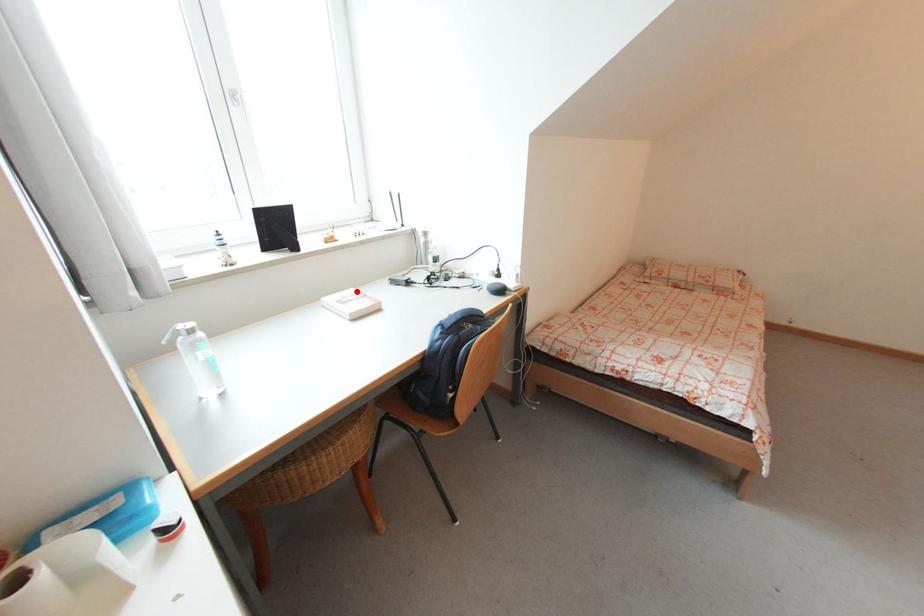
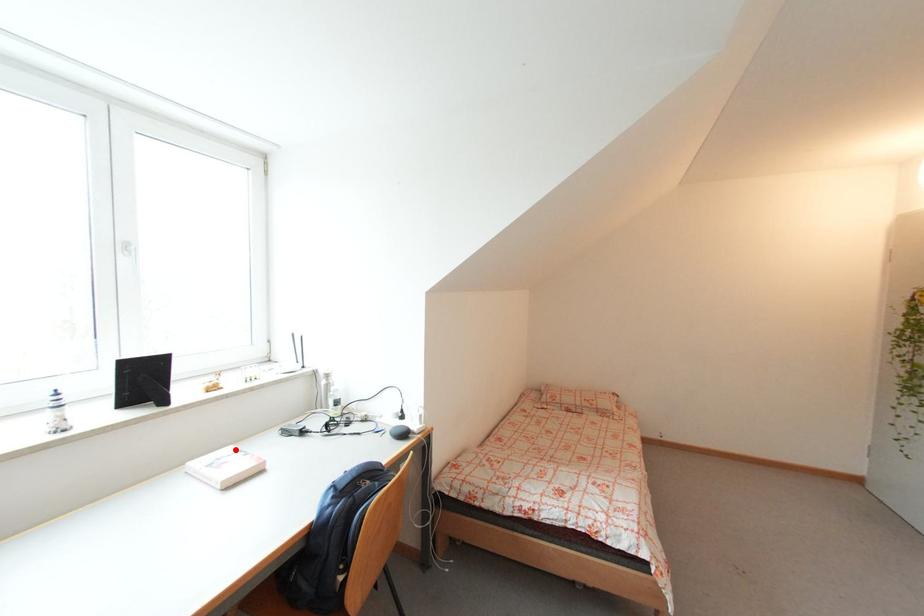
I am providing you with two images of the same scene from different viewpoints. A red point is marked on the first image and another point is marked on the second image. Is the red point in image1 aligned with the point shown in image2?

Yes